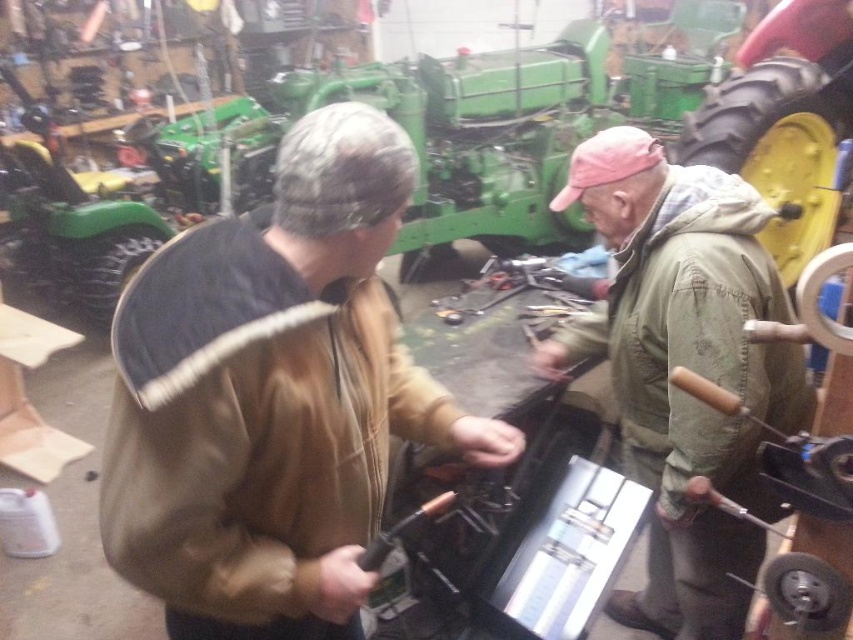
Question: Is green canvas jacket at center wider than metallic silver tool at center?

Choices:
 (A) no
 (B) yes

Answer: (A)

Question: Which point appears farthest from the camera in this image?

Choices:
 (A) (543, 288)
 (B) (357, 609)
 (C) (682, 260)

Answer: (A)

Question: Which point is farther from the camera taking this photo?

Choices:
 (A) (434, 513)
 (B) (483, 305)
 (C) (564, 346)
 (D) (135, 572)

Answer: (B)

Question: Can you confirm if green canvas jacket at center is positioned below metallic black screwdriver at center?

Choices:
 (A) no
 (B) yes

Answer: (A)

Question: Which point is closer to the camera?

Choices:
 (A) (229, 538)
 (B) (577, 289)
 (C) (734, 218)

Answer: (A)

Question: Considering the relative positions of brown fuzzy jacket at center and metallic black screwdriver at center in the image provided, where is brown fuzzy jacket at center located with respect to metallic black screwdriver at center?

Choices:
 (A) above
 (B) below

Answer: (A)